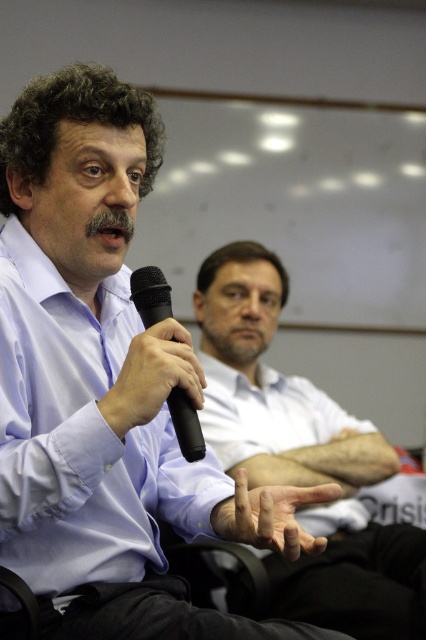
Is matte light blue shirt at left bigger than white shirt at center?

No, matte light blue shirt at left is not bigger than white shirt at center.

Based on the photo, is matte light blue shirt at left taller than white shirt at center?

In fact, matte light blue shirt at left may be shorter than white shirt at center.

You are a GUI agent. You are given a task and a screenshot of the screen. Output one action in this format:
    pyautogui.click(x=<x>, y=<y>)
    Task: Click on the matte light blue shirt at left
    Image resolution: width=426 pixels, height=640 pixels.
    Given the screenshot: What is the action you would take?
    pyautogui.click(x=81, y=436)

Is white shirt at center closer to camera compared to matte black microphone at center?

That is False.

Can you confirm if white shirt at center is taller than matte black microphone at center?

Correct, white shirt at center is much taller as matte black microphone at center.

Is point (241, 454) more distant than point (164, 355)?

Yes, point (241, 454) is behind point (164, 355).

Identify the location of white shirt at center. Image resolution: width=426 pixels, height=640 pixels. (302, 456).

Is matte light blue shirt at left positioned before smooth skin hand at center?

No.

Which of these two, matte light blue shirt at left or smooth skin hand at center, stands taller?

Standing taller between the two is matte light blue shirt at left.

Is point (6, 275) positioned before point (317, 548)?

No.

You are a GUI agent. You are given a task and a screenshot of the screen. Output one action in this format:
    pyautogui.click(x=<x>, y=<y>)
    Task: Click on the matte light blue shirt at left
    This screenshot has width=426, height=640.
    Given the screenshot: What is the action you would take?
    pyautogui.click(x=81, y=436)